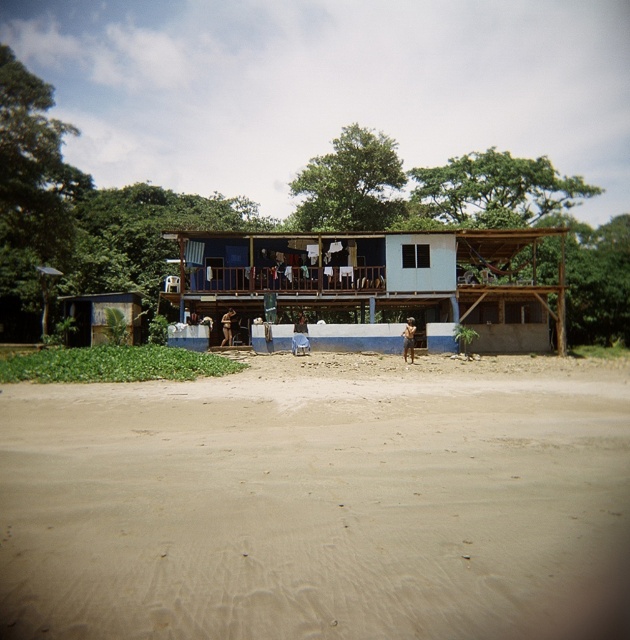
Question: Does beige sandy beach at lower center come behind blue painted wood at center?

Choices:
 (A) yes
 (B) no

Answer: (B)

Question: Does beige sandy beach at lower center appear on the right side of blue painted wood at center?

Choices:
 (A) no
 (B) yes

Answer: (A)

Question: Which of the following is the closest to the observer?

Choices:
 (A) beige sandy beach at lower center
 (B) blue painted wood at center

Answer: (A)

Question: Among these objects, which one is farthest from the camera?

Choices:
 (A) blue painted wood at center
 (B) beige sandy beach at lower center

Answer: (A)

Question: Is beige sandy beach at lower center positioned behind blue painted wood at center?

Choices:
 (A) yes
 (B) no

Answer: (B)